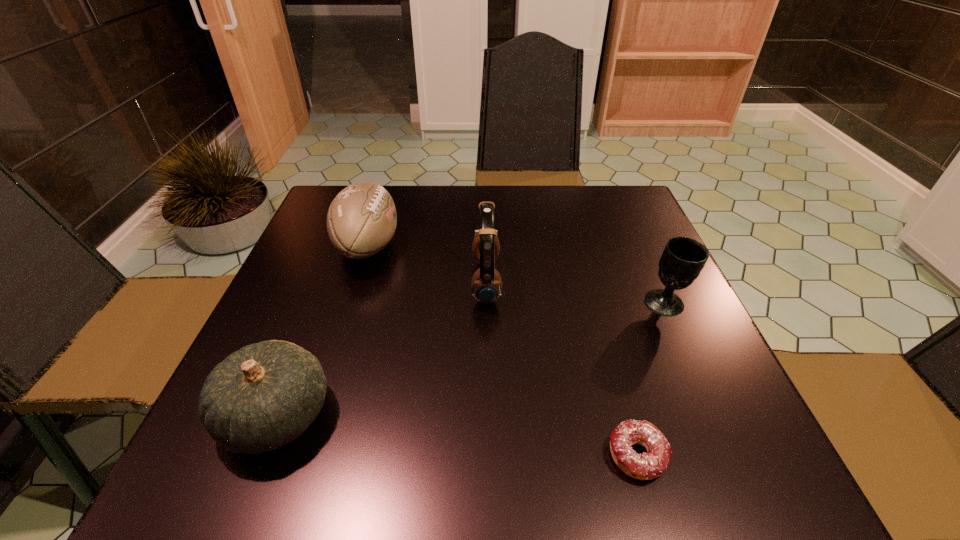
Identify the location of vacant space at the near right corner of the desktop. (702, 442).

Find the location of a particular element. free space between the chalice and the gourd is located at coordinates (470, 359).

Locate an element on the screen. Image resolution: width=960 pixels, height=540 pixels. empty space that is in between the headset and the chalice is located at coordinates (576, 293).

At what (x,y) coordinates should I click in order to perform the action: click on vacant space in between the doughnut and the rightmost object. Please return your answer as a coordinate pair (x, y). This screenshot has width=960, height=540. Looking at the image, I should click on (651, 380).

Locate an element on the screen. The height and width of the screenshot is (540, 960). vacant region between the second object from right to left and the chalice is located at coordinates (651, 380).

Image resolution: width=960 pixels, height=540 pixels. What are the coordinates of `blank region between the doughnut and the tallest object` in the screenshot? It's located at (562, 369).

The image size is (960, 540). Identify the location of vacant space that's between the rightmost object and the fourth object from left to right. (651, 380).

Locate an element on the screen. The width and height of the screenshot is (960, 540). vacant area that lies between the football (American) and the chalice is located at coordinates (516, 274).

At what (x,y) coordinates should I click in order to perform the action: click on empty location between the tallest object and the doughnut. Please return your answer as a coordinate pair (x, y). Image resolution: width=960 pixels, height=540 pixels. Looking at the image, I should click on (562, 369).

Where is `blank region between the chalice and the football (American)`? Image resolution: width=960 pixels, height=540 pixels. blank region between the chalice and the football (American) is located at coordinates (516, 274).